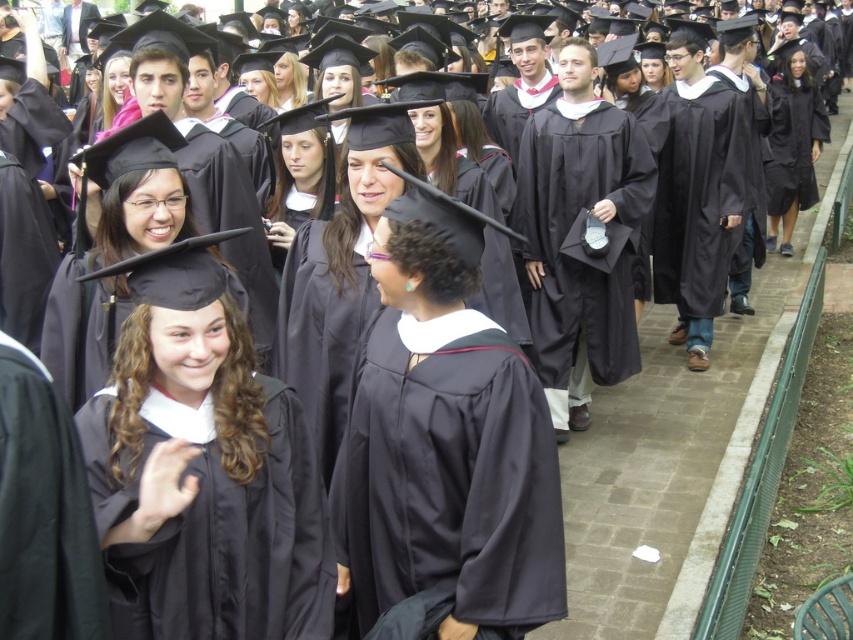
Who is positioned more to the left, matte black gown at center or black matte graduation gown at lower left?

black matte graduation gown at lower left is more to the left.

Is point (589, 292) closer to viewer compared to point (55, 477)?

No, (589, 292) is behind (55, 477).

Does point (585, 156) come farther from viewer compared to point (109, 634)?

Yes, point (585, 156) is farther from viewer.

Identify the location of matte black gown at center. This screenshot has width=853, height=640. (566, 236).

Between black matte graduation gown at center and black matte graduation gown at lower left, which one appears on the right side from the viewer's perspective?

From the viewer's perspective, black matte graduation gown at center appears more on the right side.

Which is behind, point (508, 353) or point (73, 586)?

The point (508, 353) is more distant.

Who is more distant from viewer, (457, 369) or (99, 592)?

The point (457, 369) is more distant.

Locate an element on the screen. Image resolution: width=853 pixels, height=640 pixels. black matte graduation gown at center is located at coordinates (450, 474).

Who is more distant from viewer, (380,406) or (259,499)?

Point (380,406)

Does black matte graduation gown at center appear under matte black gown at lower left?

Incorrect, black matte graduation gown at center is not positioned below matte black gown at lower left.

Which is behind, point (363, 561) or point (109, 406)?

The point (363, 561) is more distant.

At what (x,y) coordinates should I click in order to perform the action: click on black matte graduation gown at center. Please return your answer as a coordinate pair (x, y). This screenshot has width=853, height=640. Looking at the image, I should click on (450, 474).